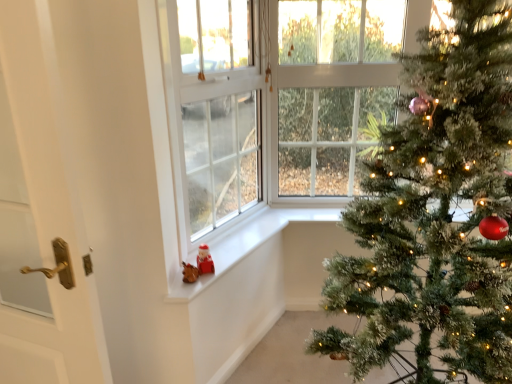
Question: Can you confirm if white plastic window screen at lower left is smaller than white matte window sill at lower center?

Choices:
 (A) yes
 (B) no

Answer: (B)

Question: From the image's perspective, is white plastic window screen at lower left over white matte window sill at lower center?

Choices:
 (A) no
 (B) yes

Answer: (B)

Question: Considering the relative positions of white plastic window screen at lower left and white matte window sill at lower center in the image provided, is white plastic window screen at lower left behind white matte window sill at lower center?

Choices:
 (A) yes
 (B) no

Answer: (B)

Question: Can you confirm if white plastic window screen at lower left is thinner than white matte window sill at lower center?

Choices:
 (A) yes
 (B) no

Answer: (A)

Question: From a real-world perspective, is white plastic window screen at lower left located beneath white matte window sill at lower center?

Choices:
 (A) yes
 (B) no

Answer: (B)

Question: Is white matte window sill at lower center in front of or behind green textured christmas tree at right in the image?

Choices:
 (A) behind
 (B) front

Answer: (A)

Question: Considering the positions of white matte window sill at lower center and green textured christmas tree at right in the image, is white matte window sill at lower center taller or shorter than green textured christmas tree at right?

Choices:
 (A) short
 (B) tall

Answer: (A)

Question: Is point (251, 231) closer or farther from the camera than point (411, 203)?

Choices:
 (A) closer
 (B) farther

Answer: (B)

Question: From the image's perspective, is white matte window sill at lower center located above or below green textured christmas tree at right?

Choices:
 (A) below
 (B) above

Answer: (A)

Question: Is green textured christmas tree at right wider or thinner than white glossy door at left?

Choices:
 (A) wide
 (B) thin

Answer: (A)

Question: Relative to white glossy door at left, is green textured christmas tree at right in front or behind?

Choices:
 (A) behind
 (B) front

Answer: (A)

Question: In terms of height, does green textured christmas tree at right look taller or shorter compared to white glossy door at left?

Choices:
 (A) short
 (B) tall

Answer: (B)

Question: Considering the relative positions of green textured christmas tree at right and white glossy door at left in the image provided, is green textured christmas tree at right to the left or to the right of white glossy door at left?

Choices:
 (A) right
 (B) left

Answer: (A)

Question: From a real-world perspective, is green textured christmas tree at right positioned above or below white matte window sill at lower center?

Choices:
 (A) below
 (B) above

Answer: (B)

Question: Would you say green textured christmas tree at right is inside or outside white matte window sill at lower center?

Choices:
 (A) outside
 (B) inside

Answer: (A)